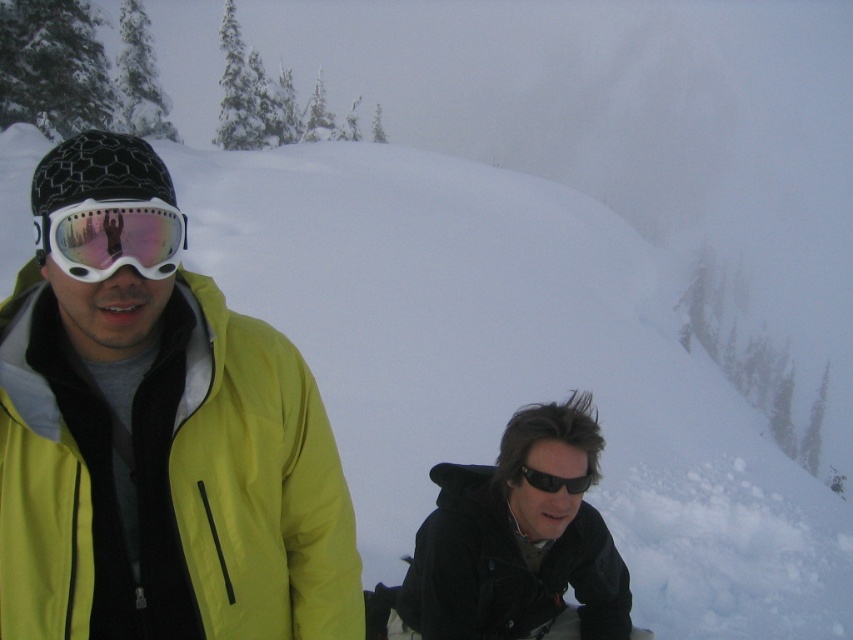
You are planning to take a photo of the matte yellow jacket at left and the black matte jacket at lower right. Which jacket should you focus on first if you want to capture both in the same frame without moving the camera?

You should focus on the matte yellow jacket at left first because it is positioned over the black matte jacket at lower right, meaning it is closer to the camera and would be in focus first.

You are a photographer trying to capture both the black matte jacket at lower right and the black reflective sunglasses at lower center in one frame. Which object will appear bigger in the photo?

The black matte jacket at lower right will appear bigger in the photo since it has a larger size compared to the black reflective sunglasses at lower center.

You are standing at the point marked as point [508,570]. Which direction should you move to reach the black matte jacket at lower right?

The point [508,570] is where the black matte jacket at lower right is located, so you are already at the position of the black matte jacket at lower right.